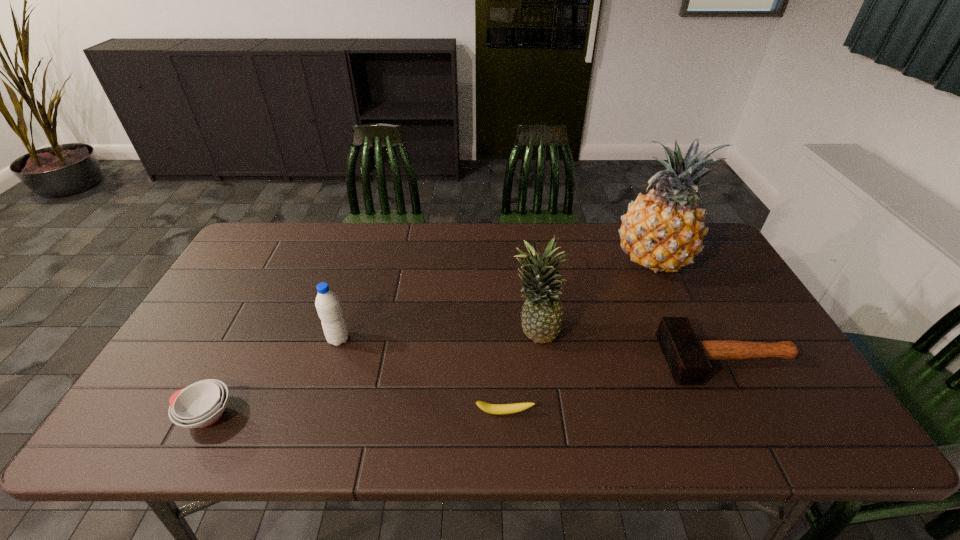
You are a GUI agent. You are given a task and a screenshot of the screen. Output one action in this format:
    pyautogui.click(x=<x>, y=<y>)
    Task: Click on the banana located at the near edge
    This screenshot has width=960, height=540.
    Given the screenshot: What is the action you would take?
    click(x=498, y=409)

At what (x,y) coordinates should I click in order to perform the action: click on object at the left edge. Please return your answer as a coordinate pair (x, y). The width and height of the screenshot is (960, 540). Looking at the image, I should click on (201, 404).

You are a GUI agent. You are given a task and a screenshot of the screen. Output one action in this format:
    pyautogui.click(x=<x>, y=<y>)
    Task: Click on the pineapple at the right edge
    The height and width of the screenshot is (540, 960).
    Given the screenshot: What is the action you would take?
    pyautogui.click(x=663, y=231)

At what (x,y) coordinates should I click in order to perform the action: click on mallet that is positioned at the right edge. Please return your answer as a coordinate pair (x, y). The image size is (960, 540). Looking at the image, I should click on (687, 357).

The width and height of the screenshot is (960, 540). In order to click on object situated at the near left corner in this screenshot , I will do `click(201, 404)`.

Find the location of a particular element. object that is at the far right corner is located at coordinates (663, 231).

Where is `blank space at the far edge of the desktop`? This screenshot has width=960, height=540. blank space at the far edge of the desktop is located at coordinates (609, 230).

Locate an element on the screen. Image resolution: width=960 pixels, height=540 pixels. vacant space at the near edge is located at coordinates (567, 423).

In the image, there is a desktop. Identify the location of free space at the left edge. The image size is (960, 540). (175, 355).

Find the location of `vacant space at the right edge of the desktop`. vacant space at the right edge of the desktop is located at coordinates [725, 288].